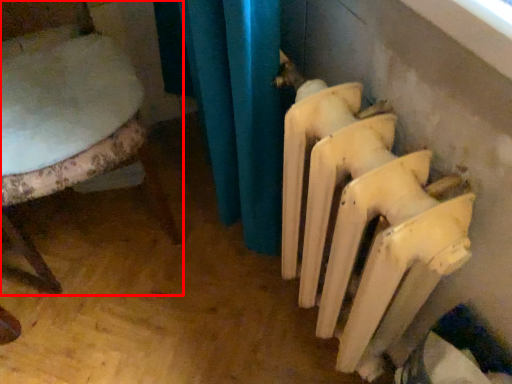
Question: From the image's perspective, where is chair (annotated by the red box) located in relation to radiator in the image?

Choices:
 (A) above
 (B) below

Answer: (A)